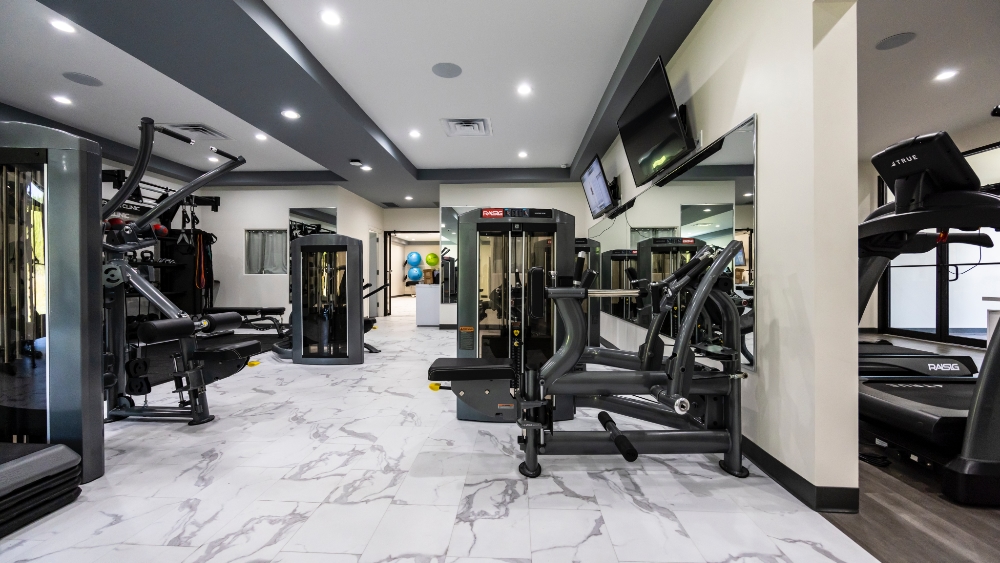
Locate an element on the screen. vinyl wood flooring is located at coordinates (943, 522).